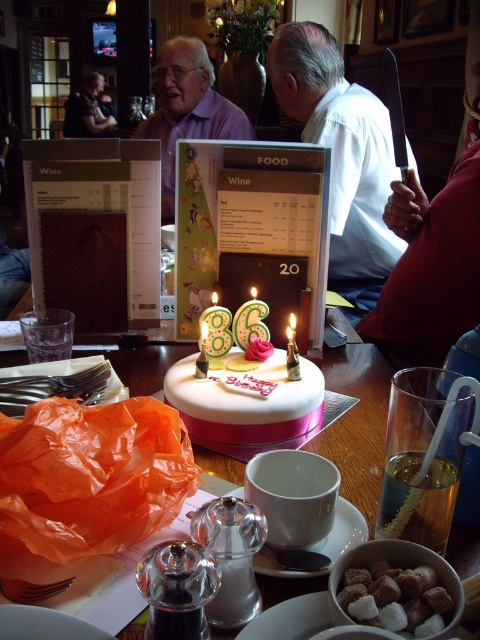
Question: Which object appears closest to the camera in this image?

Choices:
 (A) matte purple shirt at upper center
 (B) green wax candle at center
 (C) white shirt at upper center
 (D) white fondant cake at center

Answer: (D)

Question: Can you confirm if smooth skin face at upper left is smaller than translucent glass candle at center?

Choices:
 (A) yes
 (B) no

Answer: (B)

Question: Observing the image, what is the correct spatial positioning of white fondant cake at center in reference to translucent glass candle at center?

Choices:
 (A) right
 (B) left

Answer: (A)

Question: Which object is closer to the camera taking this photo?

Choices:
 (A) white sugar cubes at lower right
 (B) white shirt at upper center
 (C) translucent glass candle at center

Answer: (A)

Question: Estimate the real-world distances between objects in this image. Which object is closer to the white fondant cake at center?

Choices:
 (A) green wax candle at center
 (B) white ceramic cake at center

Answer: (B)

Question: Is matte purple shirt at upper center positioned behind green wax candle at center?

Choices:
 (A) no
 (B) yes

Answer: (B)